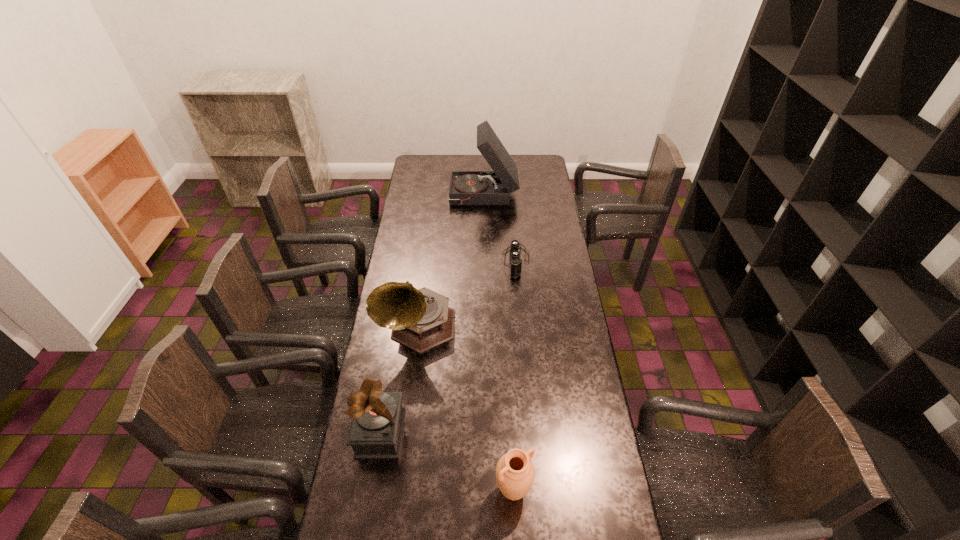
You are a GUI agent. You are given a task and a screenshot of the screen. Output one action in this format:
    pyautogui.click(x=<x>, y=<y>)
    Task: Click on the vacant area that lies between the farthest object and the nearest object
    The image size is (960, 540).
    Given the screenshot: What is the action you would take?
    pyautogui.click(x=498, y=343)

This screenshot has height=540, width=960. Identify the location of vacant area that lies between the urn and the tallest object. (498, 343).

Image resolution: width=960 pixels, height=540 pixels. What are the coordinates of `free area in between the third farthest object and the farthest object` in the screenshot? It's located at (451, 262).

This screenshot has height=540, width=960. Identify the location of empty space between the third farthest object and the farthest phonograph_record. (451, 262).

Where is `free point between the second farthest phonograph_record and the nearest phonograph_record`? free point between the second farthest phonograph_record and the nearest phonograph_record is located at coordinates (399, 380).

This screenshot has width=960, height=540. Identify the location of free space between the shortest object and the farthest object. (500, 229).

Locate an element on the screen. The width and height of the screenshot is (960, 540). vacant space in between the third farthest object and the fourth farthest object is located at coordinates (399, 380).

I want to click on vacant space that's between the second farthest phonograph_record and the nearest phonograph_record, so click(x=399, y=380).

The image size is (960, 540). I want to click on free space that is in between the second shortest object and the second farthest phonograph_record, so click(466, 409).

This screenshot has width=960, height=540. I want to click on object that is the second closest to the fourth tallest object, so click(420, 319).